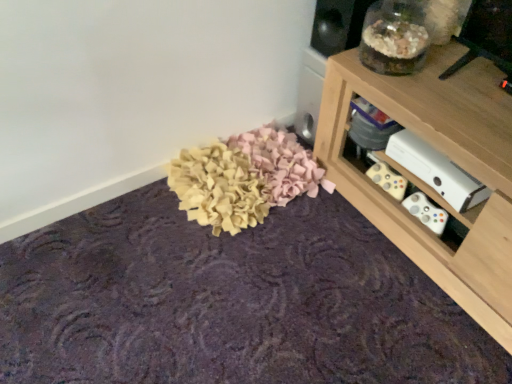
Question: Does white matte xbox at lower right have a greater height compared to felt-like fabric at center?

Choices:
 (A) yes
 (B) no

Answer: (A)

Question: Is white matte xbox at lower right aimed at felt-like fabric at center?

Choices:
 (A) no
 (B) yes

Answer: (A)

Question: Is white matte xbox at lower right to the left of felt-like fabric at center from the viewer's perspective?

Choices:
 (A) no
 (B) yes

Answer: (A)

Question: Does white matte xbox at lower right touch felt-like fabric at center?

Choices:
 (A) yes
 (B) no

Answer: (B)

Question: Is felt-like fabric at center located within white matte xbox at lower right?

Choices:
 (A) yes
 (B) no

Answer: (B)

Question: Is felt-like fabric at center taller or shorter than white matte xbox at lower right?

Choices:
 (A) tall
 (B) short

Answer: (B)

Question: From a real-world perspective, relative to white matte xbox at lower right, is felt-like fabric at center vertically above or below?

Choices:
 (A) below
 (B) above

Answer: (A)

Question: From the image's perspective, is felt-like fabric at center located above or below white matte xbox at lower right?

Choices:
 (A) above
 (B) below

Answer: (B)

Question: In the image, is felt-like fabric at center on the left side or the right side of white matte xbox at lower right?

Choices:
 (A) right
 (B) left

Answer: (B)

Question: Considering the positions of felt-like fabric at center and wooden shelf at upper right in the image, is felt-like fabric at center taller or shorter than wooden shelf at upper right?

Choices:
 (A) tall
 (B) short

Answer: (B)

Question: Considering their positions, is felt-like fabric at center located in front of or behind wooden shelf at upper right?

Choices:
 (A) behind
 (B) front

Answer: (B)

Question: Is felt-like fabric at center to the left or to the right of wooden shelf at upper right in the image?

Choices:
 (A) right
 (B) left

Answer: (B)

Question: Is felt-like fabric at center inside the boundaries of wooden shelf at upper right, or outside?

Choices:
 (A) outside
 (B) inside

Answer: (A)

Question: Considering the positions of white matte xbox at lower right and wooden shelf at upper right in the image, is white matte xbox at lower right bigger or smaller than wooden shelf at upper right?

Choices:
 (A) small
 (B) big

Answer: (A)

Question: Considering the positions of white matte xbox at lower right and wooden shelf at upper right in the image, is white matte xbox at lower right taller or shorter than wooden shelf at upper right?

Choices:
 (A) tall
 (B) short

Answer: (B)